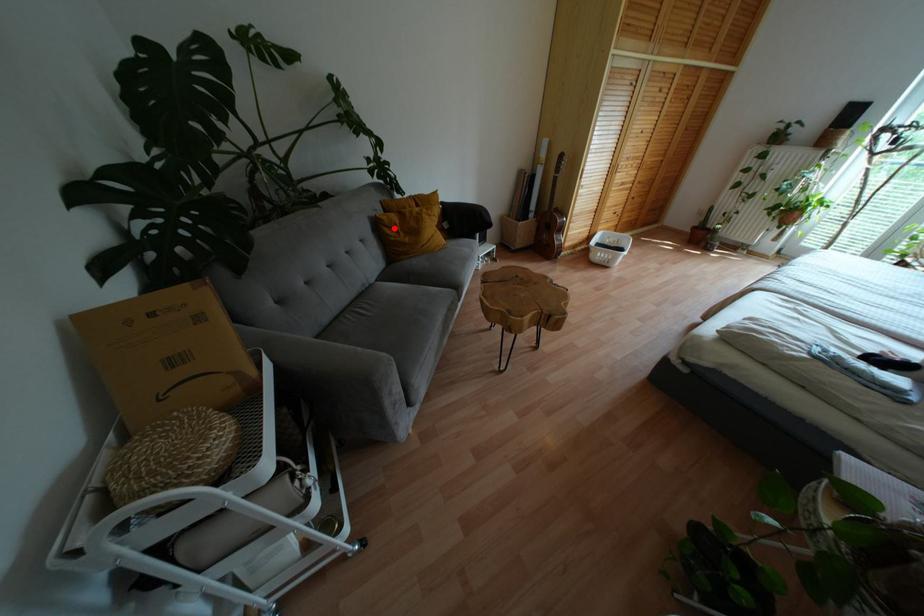
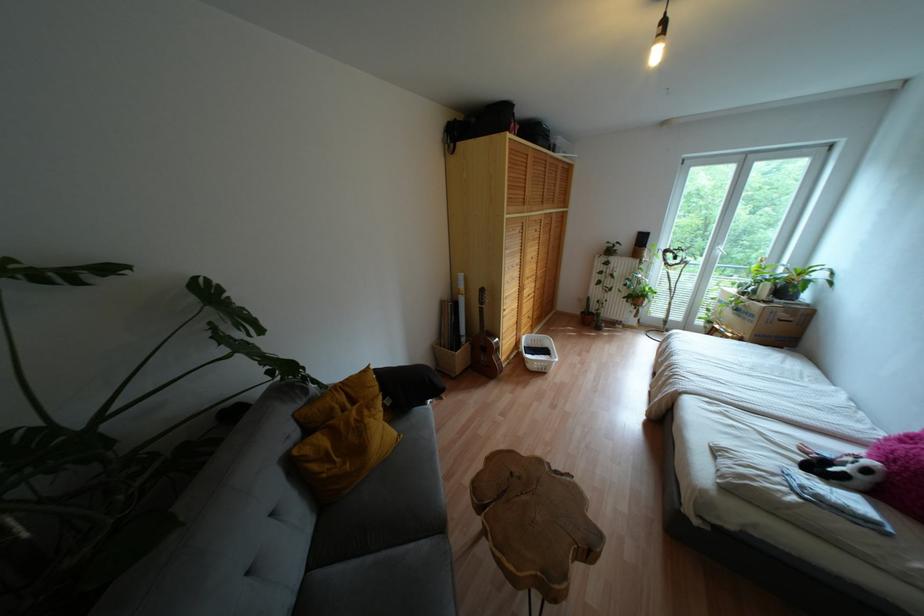
Question: A red point is marked in image1. In image2, is the corresponding 3D point closer to the camera or farther? Reply with the corresponding letter.

Choices:
 (A) The corresponding 3D point is closer.
 (B) The corresponding 3D point is farther.

Answer: (B)